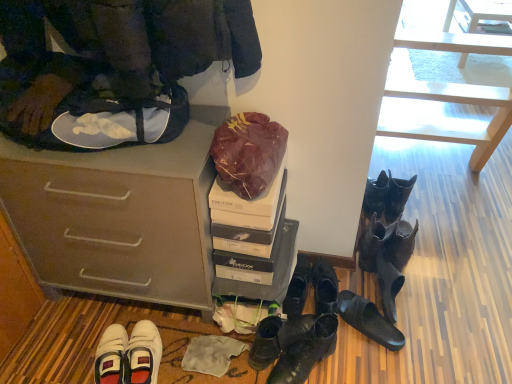
Where is `free spot above leather boots at center, acting as the eighth footwear starting from the right (from a real-world perspective)`? free spot above leather boots at center, acting as the eighth footwear starting from the right (from a real-world perspective) is located at coordinates 297,331.